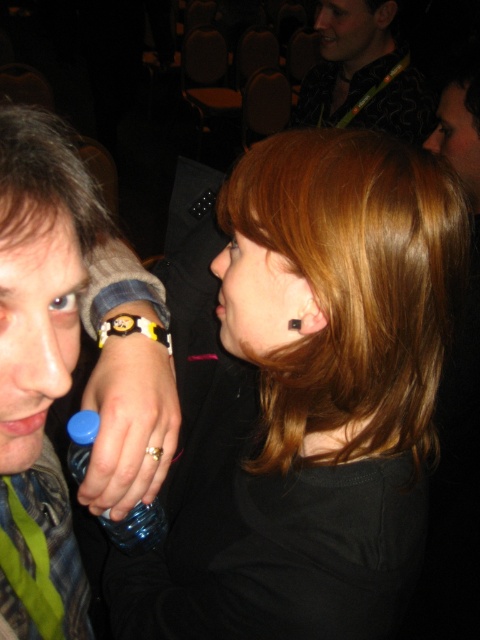
You are a photographer trying to capture a candid shot of the matte yellow bracelet at upper left and the patterned fabric shirt at upper center in the image. The camera you are using has a maximum focus range of 1.8 meters. Will both subjects be in focus if you position the camera to focus on the midpoint between them?

The matte yellow bracelet at upper left and the patterned fabric shirt at upper center are 1.78 meters apart. Since the camera can focus up to 1.8 meters, focusing on the midpoint will ensure both are within the focus range as the distance between them is slightly less than the maximum focus range.

You are a photographer at the event and need to capture a closeup shot of the matte black bracelet at left. The camera you are using has a minimum focusing distance of 14 inches. Will you be able to take the photo without moving closer?

The matte black bracelet at left is 13.69 inches from the camera, which is within the minimum focusing distance of 14 inches. Therefore, you can take the closeup shot without moving closer.

You are at a social event and notice two bracelets on the same person. The person is wearing a matte black bracelet at left and a matte yellow bracelet at upper left. Which bracelet is positioned to the left of the other?

The matte black bracelet at left is positioned to the left of the matte yellow bracelet at upper left.